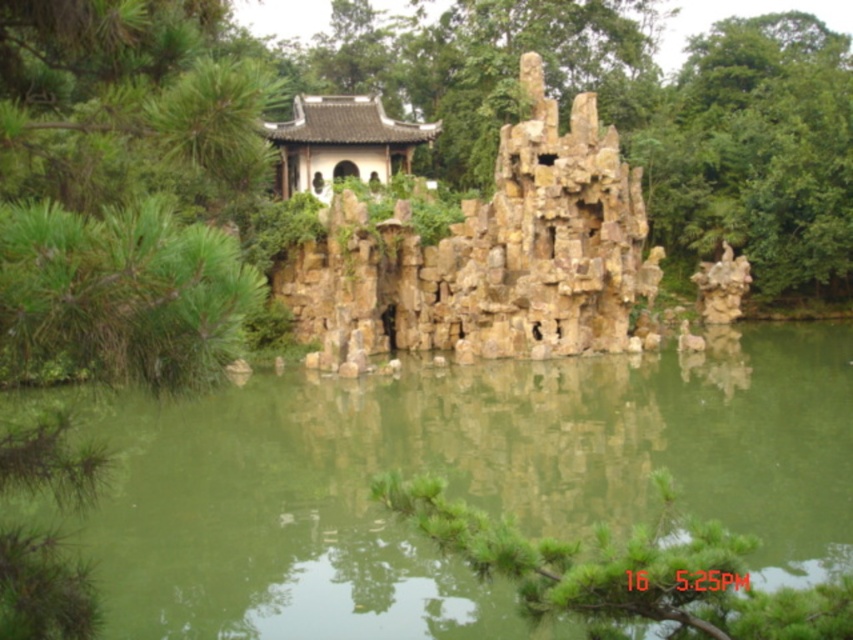
You are standing in the garden and want to walk from point A to point B. Point A is located at coordinates point (521, 124), and point B is at point (126, 310). Which point is closer to you when you start your journey?

Point A at point (521, 124) is closer to you because it is further to the viewer than point B at point (126, 310), meaning it requires fewer steps to reach.

You are standing in the garden and want to take a photo of the green leafy tree at left. If your camera can focus on objects up to 100 feet away, will you need to move closer to take a clear photo?

The green leafy tree at left is 100.98 feet away from the viewer. Since the camera can focus up to 100 feet, you need to move closer to ensure the tree is within the camera range.